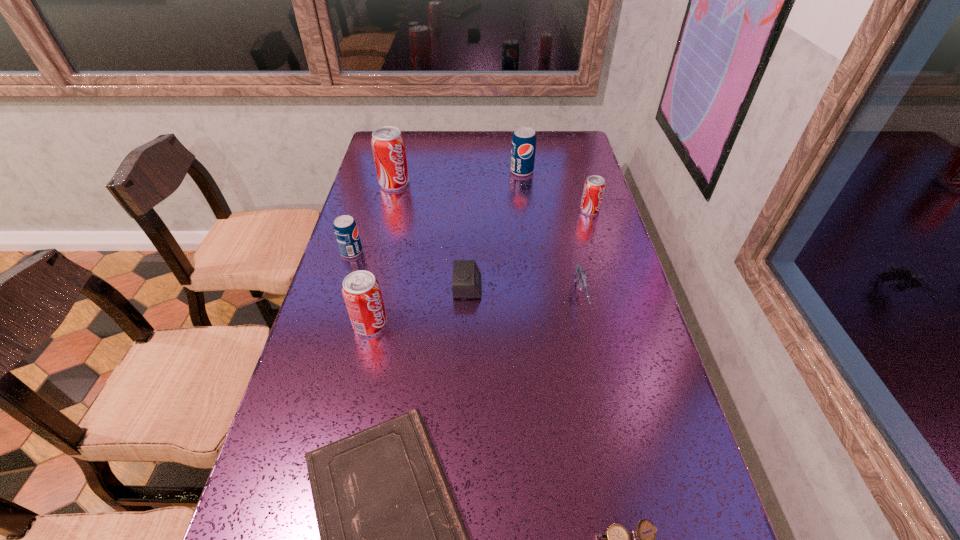
You are a GUI agent. You are given a task and a screenshot of the screen. Output one action in this format:
    pyautogui.click(x=<x>, y=<y>)
    Task: Click on the fourth shortest object
    
    Given the screenshot: What is the action you would take?
    point(579,276)

This screenshot has height=540, width=960. I want to click on black alarm clock, so click(466, 283).

Find the location of `alarm clock`. alarm clock is located at coordinates (466, 283).

Find the location of a particular element. Image resolution: width=960 pixels, height=540 pixels. free space located 0.180m on the front of the tallest pop is located at coordinates click(x=384, y=224).

Locate an element on the screen. free space located on the front of the second pop from right to left is located at coordinates (530, 233).

Where is `free space located 0.050m on the front of the nearest pop`? free space located 0.050m on the front of the nearest pop is located at coordinates (364, 354).

This screenshot has width=960, height=540. I want to click on vacant space situated 0.290m on the back of the rightmost pop, so click(575, 160).

The height and width of the screenshot is (540, 960). I want to click on free spot located 0.300m on the front of the fourth farthest object, so click(x=324, y=342).

Find the location of a particular element. blank area located 0.170m at the barrel of the gun is located at coordinates (597, 384).

Identify the location of free space located on the front-facing side of the black alarm clock. This screenshot has width=960, height=540. (612, 287).